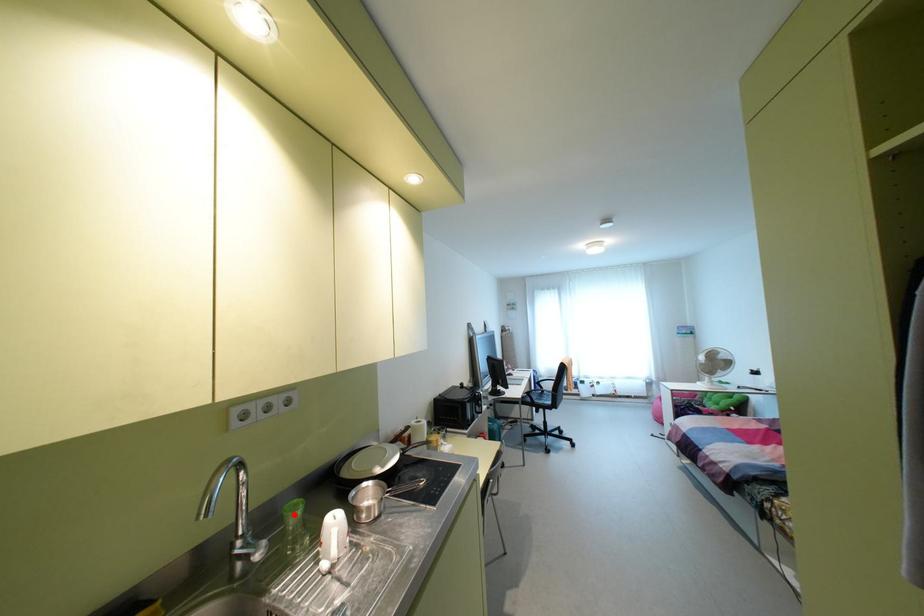
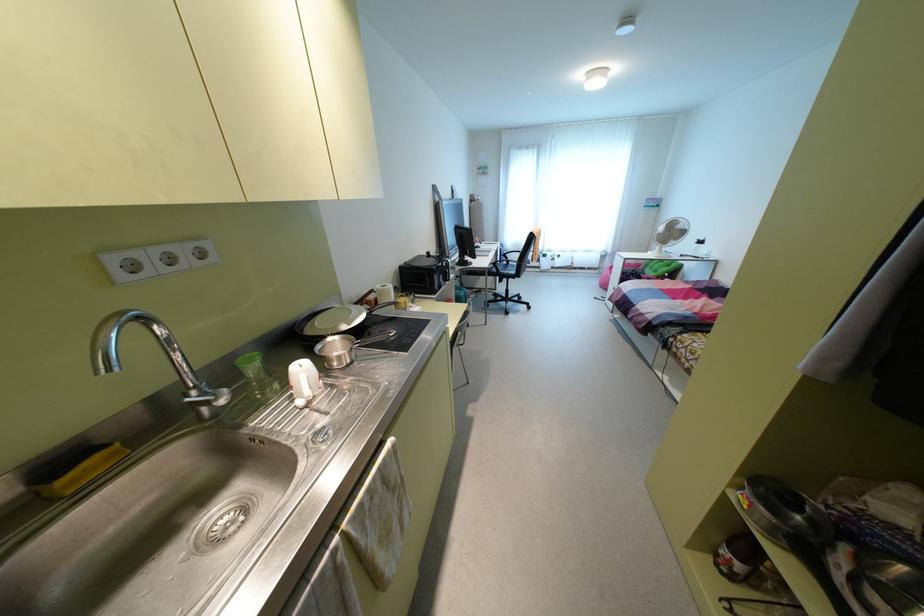
Locate, in the second image, the point that corresponds to the highlighted location in the first image.

(251, 366)